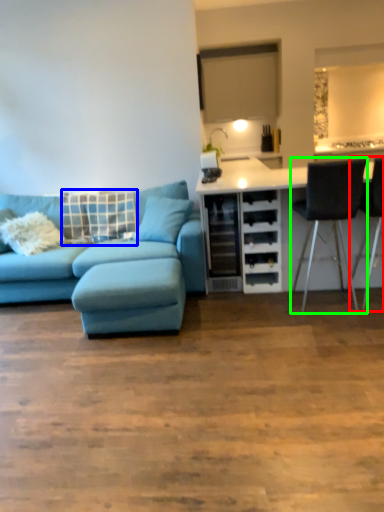
Question: Which is farther away from chair (highlighted by a red box)? pillow (highlighted by a blue box) or chair (highlighted by a green box)?

Choices:
 (A) pillow
 (B) chair

Answer: (A)